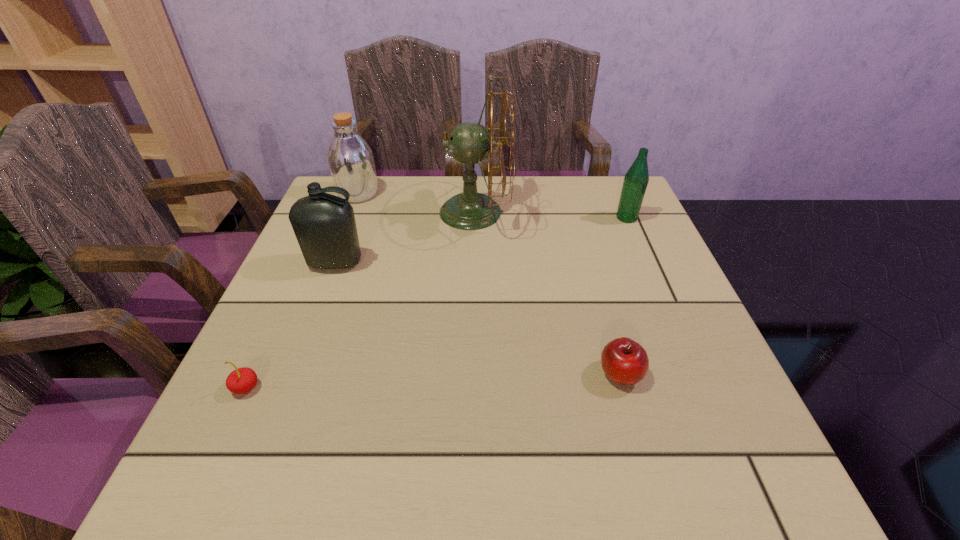
The width and height of the screenshot is (960, 540). In the image, there is a desktop. Find the location of `vacant space at the far edge`. vacant space at the far edge is located at coordinates (531, 200).

Locate an element on the screen. The image size is (960, 540). blank space at the left edge is located at coordinates (307, 339).

You are a GUI agent. You are given a task and a screenshot of the screen. Output one action in this format:
    pyautogui.click(x=<x>, y=<y>)
    Task: Click on the free spot at the right edge of the desktop
    Image resolution: width=960 pixels, height=540 pixels.
    Given the screenshot: What is the action you would take?
    pyautogui.click(x=660, y=428)

In the image, there is a desktop. At what (x,y) coordinates should I click in order to perform the action: click on vacant space at the far left corner. Please return your answer as a coordinate pair (x, y). This screenshot has height=540, width=960. Looking at the image, I should click on (357, 211).

In the image, there is a desktop. Where is `free region at the near left corner`? This screenshot has height=540, width=960. free region at the near left corner is located at coordinates (272, 449).

In the image, there is a desktop. Where is `free space at the far right corner`? free space at the far right corner is located at coordinates (588, 190).

Locate an element on the screen. This screenshot has height=540, width=960. vacant space in between the farthest bottle and the apple is located at coordinates (489, 284).

What are the coordinates of `free spot between the cherry and the second object from right to left` in the screenshot? It's located at (433, 381).

You are a GUI agent. You are given a task and a screenshot of the screen. Output one action in this format:
    pyautogui.click(x=<x>, y=<y>)
    Task: Click on the free space between the apple and the third nearest object
    The image size is (960, 540).
    Given the screenshot: What is the action you would take?
    pyautogui.click(x=478, y=319)

The width and height of the screenshot is (960, 540). I want to click on blank region between the rightmost object and the apple, so point(623,296).